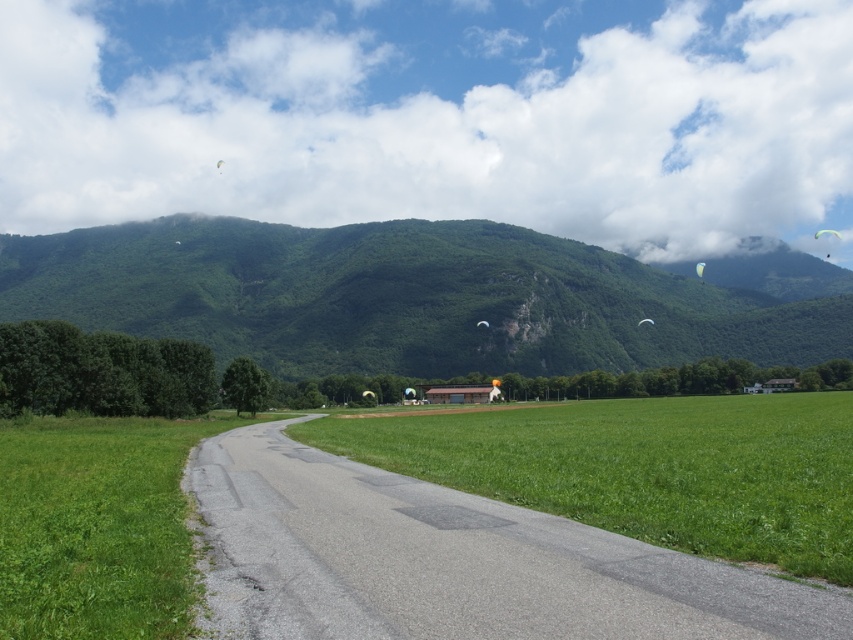
Who is lower down, green leafy mountain at center or white fabric kite at upper right?

green leafy mountain at center is lower down.

Between green leafy mountain at center and white fabric kite at upper right, which one has less height?

With less height is white fabric kite at upper right.

Find the location of a particular element. The width and height of the screenshot is (853, 640). green leafy mountain at center is located at coordinates pos(415,298).

You are a GUI agent. You are given a task and a screenshot of the screen. Output one action in this format:
    pyautogui.click(x=<x>, y=<y>)
    Task: Click on the green leafy mountain at center
    
    Given the screenshot: What is the action you would take?
    pyautogui.click(x=415, y=298)

Which is more to the left, green leafy mountain at center or green fabric kite at upper right?

green leafy mountain at center is more to the left.

Which of these two, green leafy mountain at center or green fabric kite at upper right, stands shorter?

Standing shorter between the two is green fabric kite at upper right.

At what (x,y) coordinates should I click in order to perform the action: click on green leafy mountain at center. Please return your answer as a coordinate pair (x, y). Image resolution: width=853 pixels, height=640 pixels. Looking at the image, I should click on (415, 298).

I want to click on green fabric kite at upper right, so click(827, 232).

Between point (820, 230) and point (700, 275), which one is positioned in front?

Point (700, 275) is more forward.

This screenshot has width=853, height=640. In order to click on green fabric kite at upper right in this screenshot , I will do `click(827, 232)`.